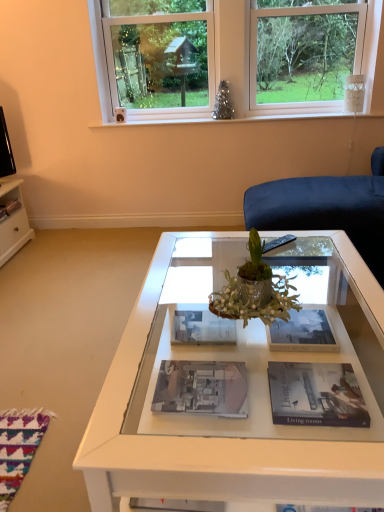
How much space does matte black magazine at left, acting as the fifth magazine starting from the right, occupy vertically?

matte black magazine at left, acting as the fifth magazine starting from the right, is 3.20 inches tall.

This screenshot has height=512, width=384. What do you see at coordinates (254, 290) in the screenshot?
I see `green metallic vase at center` at bounding box center [254, 290].

Describe the element at coordinates (302, 332) in the screenshot. I see `matte paper magazine at center, placed as the third magazine when sorted from front to back` at that location.

You are a GUI agent. You are given a task and a screenshot of the screen. Output one action in this format:
    pyautogui.click(x=<x>, y=<y>)
    Task: Click on the matte paper magazine at center, which is the 1th magazine in bottom-to-top order
    
    Given the screenshot: What is the action you would take?
    pyautogui.click(x=316, y=395)

Could you tell me if white glossy magazine at center, the third magazine in the left-to-right sequence, is facing matte black magazine at left, marked as the first magazine in a back-to-front arrangement?

No, white glossy magazine at center, the third magazine in the left-to-right sequence, is not oriented towards matte black magazine at left, marked as the first magazine in a back-to-front arrangement.

Which of these two, white glossy magazine at center, marked as the 3th magazine in a right-to-left arrangement, or matte black magazine at left, marked as the first magazine in a back-to-front arrangement, is wider?

Wider between the two is white glossy magazine at center, marked as the 3th magazine in a right-to-left arrangement.

Could you measure the distance between white glossy magazine at center, the 4th magazine when ordered from front to back, and matte black magazine at left, marked as the first magazine in a back-to-front arrangement?

A distance of 1.73 meters exists between white glossy magazine at center, the 4th magazine when ordered from front to back, and matte black magazine at left, marked as the first magazine in a back-to-front arrangement.

From a real-world perspective, starting from the white glossy magazine at center, marked as the 3th magazine in a right-to-left arrangement, which magazine is the 4th one vertically above it? Please provide its 2D coordinates.

[(8, 207)]

In the scene shown: Which object is positioned more to the right, matte black magazine at left, placed as the 1th magazine when sorted from top to bottom, or white glossy magazine at center, which is the 3th magazine from top to bottom?

Positioned to the right is white glossy magazine at center, which is the 3th magazine from top to bottom.

Does matte black magazine at left, which ranks as the 5th magazine in front-to-back order, touch white glossy magazine at center, the third magazine in the left-to-right sequence?

They are not placed beside each other.

Is matte black magazine at left, the 1th magazine positioned from the left, looking in the opposite direction of white glossy magazine at center, which is the 3th magazine from top to bottom?

No, matte black magazine at left, the 1th magazine positioned from the left, is not facing away from white glossy magazine at center, which is the 3th magazine from top to bottom.

How distant is matte black magazine at left, which ranks as the 5th magazine in front-to-back order, from white glossy magazine at center, the third magazine in the left-to-right sequence?

5.67 feet.

Between matte black book at center, which is counted as the fourth magazine, starting from the top, and white glossy coffee table at center, which one has less height?

matte black book at center, which is counted as the fourth magazine, starting from the top.

Is point (202, 375) positioned after point (170, 478)?

That is True.

From the image's perspective, is matte black book at center, the 2th magazine in the bottom-to-top sequence, located above or below white glossy coffee table at center?

Clearly, from the image's perspective, matte black book at center, the 2th magazine in the bottom-to-top sequence, is below white glossy coffee table at center.

Does matte black book at center, acting as the 2th magazine starting from the front, have a smaller size compared to white glossy coffee table at center?

Yes, matte black book at center, acting as the 2th magazine starting from the front, is smaller than white glossy coffee table at center.

Who is more distant, matte paper magazine at center, the 2th magazine positioned from the top, or matte black book at center, arranged as the second magazine when viewed from the left?

matte paper magazine at center, the 2th magazine positioned from the top.

Is matte paper magazine at center, placed as the third magazine when sorted from front to back, looking in the opposite direction of matte black book at center, which appears as the 4th magazine when viewed from the back?

No, matte paper magazine at center, placed as the third magazine when sorted from front to back,'s orientation is not away from matte black book at center, which appears as the 4th magazine when viewed from the back.

From the image's perspective, relative to matte black book at center, which appears as the 4th magazine when viewed from the back, is matte paper magazine at center, the third magazine when ordered from back to front, above or below?

Based on their image positions, matte paper magazine at center, the third magazine when ordered from back to front, is located above matte black book at center, which appears as the 4th magazine when viewed from the back.

Consider the image. Is matte black book at center, which is counted as the fourth magazine, starting from the right, a part of matte paper magazine at center, the 2th magazine positioned from the top?

No, matte black book at center, which is counted as the fourth magazine, starting from the right, is not surrounded by matte paper magazine at center, the 2th magazine positioned from the top.

Is white glossy coffee table at center situated inside matte black magazine at left, placed as the 1th magazine when sorted from top to bottom, or outside?

white glossy coffee table at center cannot be found inside matte black magazine at left, placed as the 1th magazine when sorted from top to bottom.

Does white glossy coffee table at center come in front of matte black magazine at left, the 1th magazine positioned from the left?

Yes, it is in front of matte black magazine at left, the 1th magazine positioned from the left.

Considering the relative sizes of white glossy coffee table at center and matte black magazine at left, marked as the first magazine in a back-to-front arrangement, in the image provided, is white glossy coffee table at center thinner than matte black magazine at left, marked as the first magazine in a back-to-front arrangement,?

No, white glossy coffee table at center is not thinner than matte black magazine at left, marked as the first magazine in a back-to-front arrangement.

Is white glossy coffee table at center next to matte black magazine at left, which ranks as the 5th magazine in front-to-back order?

white glossy coffee table at center and matte black magazine at left, which ranks as the 5th magazine in front-to-back order, are not in contact.

Is matte black book at center, which is counted as the fourth magazine, starting from the right, spatially inside matte paper magazine at center, the third magazine when ordered from back to front, or outside of it?

matte black book at center, which is counted as the fourth magazine, starting from the right, is not inside matte paper magazine at center, the third magazine when ordered from back to front, it's outside.

From a real-world perspective, is matte black book at center, which appears as the 4th magazine when viewed from the back, beneath matte paper magazine at center, acting as the 4th magazine starting from the bottom?

Correct, in the physical world, matte black book at center, which appears as the 4th magazine when viewed from the back, is lower than matte paper magazine at center, acting as the 4th magazine starting from the bottom.

Measure the distance between matte black book at center, which is counted as the fourth magazine, starting from the right, and matte paper magazine at center, which is the 5th magazine from left to right.

matte black book at center, which is counted as the fourth magazine, starting from the right, is 13.51 inches from matte paper magazine at center, which is the 5th magazine from left to right.

Could you tell me if matte black book at center, arranged as the second magazine when viewed from the left, is turned towards matte paper magazine at center, which ranks as the 1th magazine in right-to-left order?

No, matte black book at center, arranged as the second magazine when viewed from the left, is not aimed at matte paper magazine at center, which ranks as the 1th magazine in right-to-left order.

Is white glossy magazine at center, the 4th magazine when ordered from front to back, bigger than white plastic window at upper center?

No.

Does point (170, 318) appear closer or farther from the camera than point (248, 38)?

Point (170, 318) is closer to the camera than point (248, 38).

Is white plastic window at upper center inside white glossy magazine at center, the 4th magazine when ordered from front to back?

No.

Is the depth of white glossy magazine at center, marked as the 3th magazine in a right-to-left arrangement, greater than that of white plastic window at upper center?

No, it is in front of white plastic window at upper center.

Where is `the 2nd magazine to the right of the matte black magazine at left, acting as the fifth magazine starting from the right, counting from the anchor's position`? The width and height of the screenshot is (384, 512). the 2nd magazine to the right of the matte black magazine at left, acting as the fifth magazine starting from the right, counting from the anchor's position is located at coordinates pyautogui.click(x=201, y=328).

Identify the location of the 1st magazine in front of the matte black magazine at left, which ranks as the 5th magazine in front-to-back order. The height and width of the screenshot is (512, 384). (201, 328).

Looking at this image, considering their positions, is matte paper magazine at center, acting as the 5th magazine starting from the back, positioned further to matte black magazine at left, the 1th magazine positioned from the left, than white glossy coffee table at center?

Among the two, matte paper magazine at center, acting as the 5th magazine starting from the back, is located further to matte black magazine at left, the 1th magazine positioned from the left.

Estimate the real-world distances between objects in this image. Which object is further from green metallic vase at center, white plastic window at upper center or matte black book at center, which is counted as the fourth magazine, starting from the right?

Based on the image, white plastic window at upper center appears to be further to green metallic vase at center.

Based on their spatial positions, is white plastic window at upper center or white glossy coffee table at center closer to matte black book at center, which is counted as the fourth magazine, starting from the right?

The object closer to matte black book at center, which is counted as the fourth magazine, starting from the right, is white glossy coffee table at center.

Estimate the real-world distances between objects in this image. Which object is further from white glossy coffee table at center, white plastic window at upper center or matte paper magazine at center, acting as the 5th magazine starting from the back?

white plastic window at upper center is further to white glossy coffee table at center.

Which object lies nearer to the anchor point white plastic window at upper center, green metallic vase at center or matte paper magazine at center, which ranks as the 1th magazine in right-to-left order?

matte paper magazine at center, which ranks as the 1th magazine in right-to-left order.

Considering their positions, is white plastic window at upper center positioned further to white glossy coffee table at center than matte black magazine at left, the 5th magazine when ordered from bottom to top?

matte black magazine at left, the 5th magazine when ordered from bottom to top, is further to white glossy coffee table at center.

In the scene shown: Looking at the image, which one is located closer to matte paper magazine at center, which ranks as the first magazine in front-to-back order, white plastic window at upper center or green metallic vase at center?

green metallic vase at center is closer to matte paper magazine at center, which ranks as the first magazine in front-to-back order.

Which object lies nearer to the anchor point green metallic vase at center, matte paper magazine at center, acting as the fifth magazine starting from the top, or white glossy magazine at center, which is counted as the third magazine, starting from the bottom?

Among the two, matte paper magazine at center, acting as the fifth magazine starting from the top, is located nearer to green metallic vase at center.

Where is `coffee table between white plastic window at upper center and matte black book at center, acting as the 2th magazine starting from the front, from top to bottom`? coffee table between white plastic window at upper center and matte black book at center, acting as the 2th magazine starting from the front, from top to bottom is located at coordinates point(209,440).

Locate an element on the screen. window between green metallic vase at center and matte black magazine at left, acting as the fifth magazine starting from the right, in the front-back direction is located at coordinates (242, 60).

The width and height of the screenshot is (384, 512). In order to click on houseplant between white plastic window at upper center and matte paper magazine at center, the 4th magazine viewed from the left, in the vertical direction in this screenshot , I will do `click(254, 290)`.

The image size is (384, 512). In order to click on houseplant between white plastic window at upper center and matte paper magazine at center, which is the 5th magazine from left to right, from top to bottom in this screenshot , I will do `click(254, 290)`.